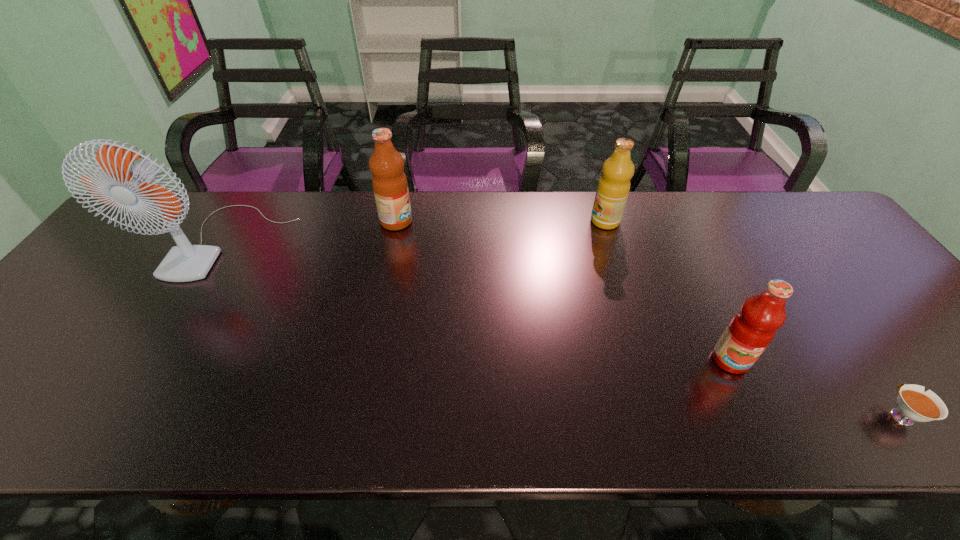
Locate an element on the screen. Image resolution: width=960 pixels, height=540 pixels. object that is at the far left corner is located at coordinates (185, 262).

You are a GUI agent. You are given a task and a screenshot of the screen. Output one action in this format:
    pyautogui.click(x=<x>, y=<y>)
    Task: Click on the object present at the near right corner
    
    Given the screenshot: What is the action you would take?
    pyautogui.click(x=914, y=404)

Locate an element on the screen. This screenshot has height=540, width=960. vacant point at the far edge is located at coordinates (264, 213).

This screenshot has height=540, width=960. In the image, there is a desktop. In order to click on blank space at the near edge in this screenshot , I will do `click(86, 420)`.

At what (x,y) coordinates should I click in order to perform the action: click on free space at the left edge of the desktop. Please return your answer as a coordinate pair (x, y). The height and width of the screenshot is (540, 960). Looking at the image, I should click on (40, 337).

Find the location of `vacant space at the right edge`. vacant space at the right edge is located at coordinates (958, 380).

I want to click on vacant region at the far right corner of the desktop, so click(x=826, y=232).

This screenshot has height=540, width=960. I want to click on free space between the second fruit juice from left to right and the fourth object from right to left, so click(x=501, y=221).

Image resolution: width=960 pixels, height=540 pixels. What are the coordinates of `empty space between the second object from right to left and the second fruit juice from left to right` in the screenshot? It's located at (668, 291).

The image size is (960, 540). Find the location of `free point between the fourth object from right to left and the rightmost object`. free point between the fourth object from right to left and the rightmost object is located at coordinates (648, 318).